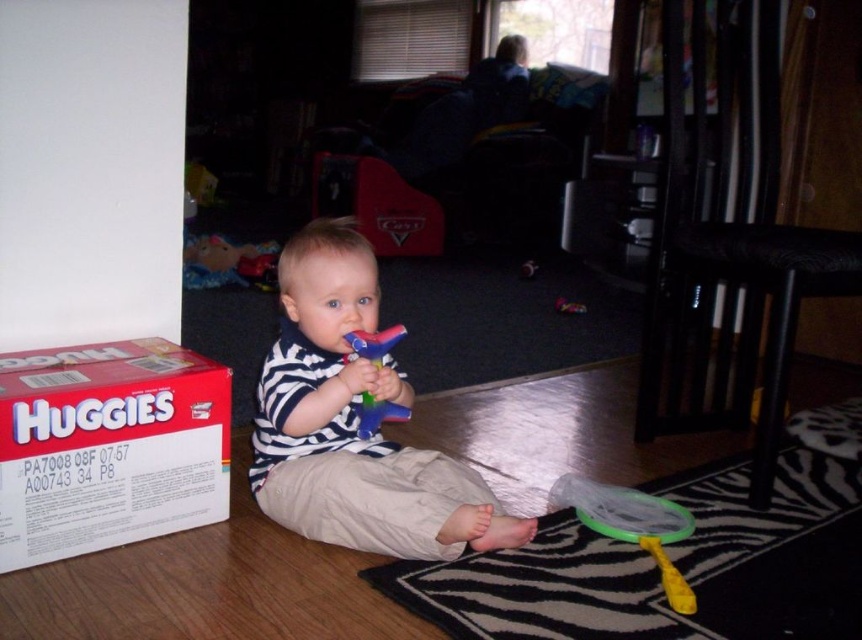
What do you see at coordinates (354, 422) in the screenshot? I see `striped fabric shirt at center` at bounding box center [354, 422].

Who is positioned more to the right, striped fabric shirt at center or red cardboard box at lower left?

striped fabric shirt at center is more to the right.

Is point (254, 464) positioned in front of point (230, 387)?

No, (254, 464) is behind (230, 387).

I want to click on striped fabric shirt at center, so click(354, 422).

Measure the distance between point (147, 365) and camera.

The distance of point (147, 365) from camera is 1.31 meters.

Between point (130, 376) and point (378, 333), which one is positioned in front?

Point (130, 376)

Between point (175, 388) and point (384, 408), which one is positioned in front?

Point (175, 388) is in front.

I want to click on red cardboard box at lower left, so [x=108, y=448].

Based on the photo, can you confirm if striped fabric shirt at center is bigger than rubber duck at center?

Correct, striped fabric shirt at center is larger in size than rubber duck at center.

Who is more distant from viewer, (336, 292) or (369, 396)?

The point (369, 396) is behind.

Locate an element on the screen. The width and height of the screenshot is (862, 640). striped fabric shirt at center is located at coordinates (354, 422).